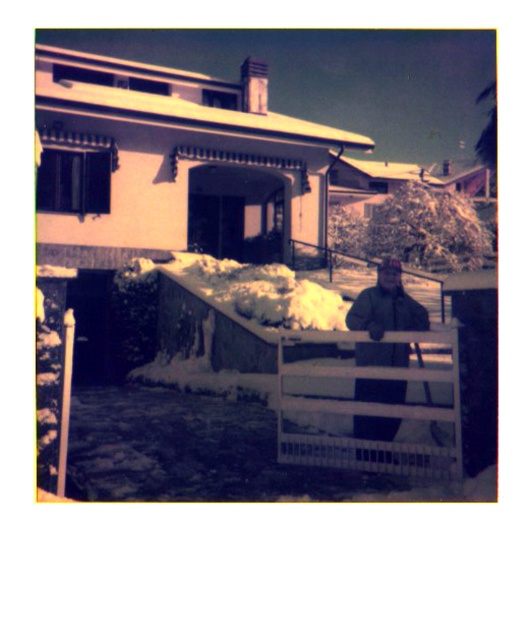
At what (x,y) coordinates should I click in order to perform the action: click on white matte fence at center. Please return your answer as a coordinate pair (x, y). Image resolution: width=529 pixels, height=640 pixels. Looking at the image, I should click on (369, 406).

Can you confirm if white matte fence at center is shorter than green matte jacket at center?

Indeed, white matte fence at center has a lesser height compared to green matte jacket at center.

The image size is (529, 640). Find the location of `white matte fence at center`. white matte fence at center is located at coordinates (369, 406).

This screenshot has height=640, width=529. Identify the location of white matte fence at center. (369, 406).